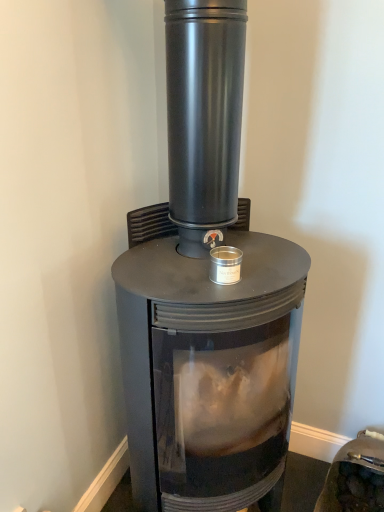
Question: Is black matte wood burning stove at center wider or thinner than matte black stove at center?

Choices:
 (A) wide
 (B) thin

Answer: (A)

Question: Would you say black matte wood burning stove at center is to the left or to the right of matte black stove at center in the picture?

Choices:
 (A) right
 (B) left

Answer: (B)

Question: From a real-world perspective, is black matte wood burning stove at center positioned above or below matte black stove at center?

Choices:
 (A) above
 (B) below

Answer: (A)

Question: Considering the positions of matte black stove at center and black matte wood burning stove at center in the image, is matte black stove at center wider or thinner than black matte wood burning stove at center?

Choices:
 (A) thin
 (B) wide

Answer: (A)

Question: Is matte black stove at center in front of or behind black matte wood burning stove at center in the image?

Choices:
 (A) behind
 (B) front

Answer: (A)

Question: Does point (344, 454) appear closer or farther from the camera than point (244, 404)?

Choices:
 (A) farther
 (B) closer

Answer: (A)

Question: In terms of height, does matte black stove at center look taller or shorter compared to black matte wood burning stove at center?

Choices:
 (A) short
 (B) tall

Answer: (A)